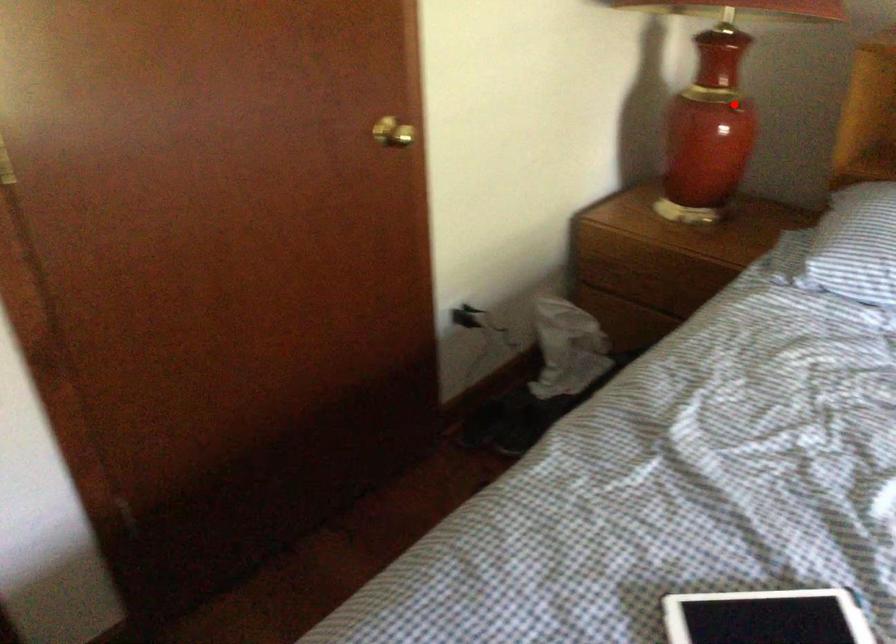
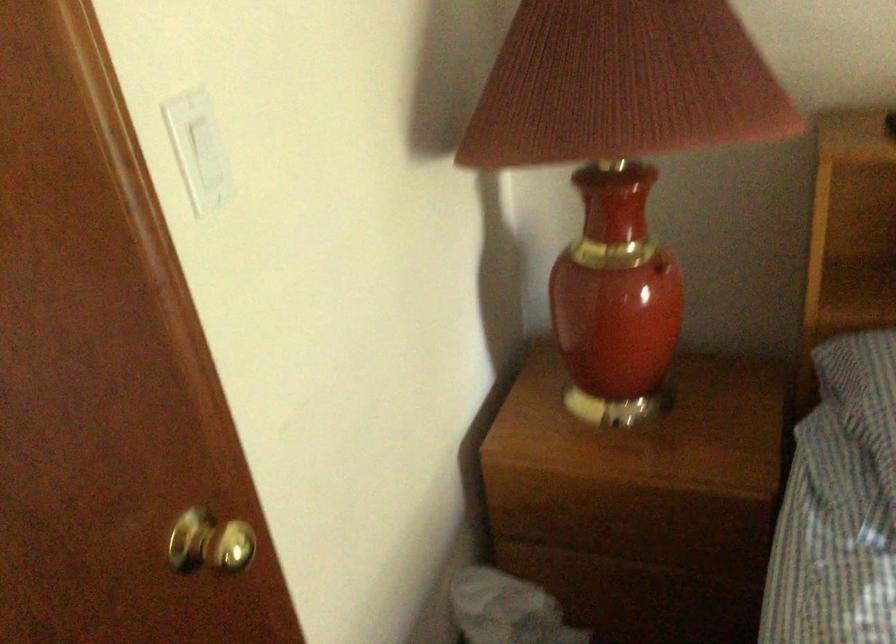
In the second image, find the point that corresponds to the highlighted location in the first image.

(661, 267)